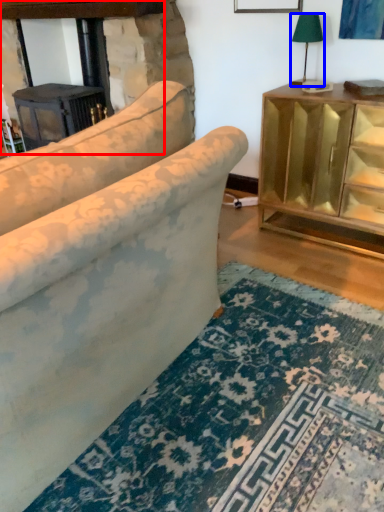
Question: Among these objects, which one is nearest to the camera, fireplace (highlighted by a red box) or table lamp (highlighted by a blue box)?

Choices:
 (A) fireplace
 (B) table lamp

Answer: (B)